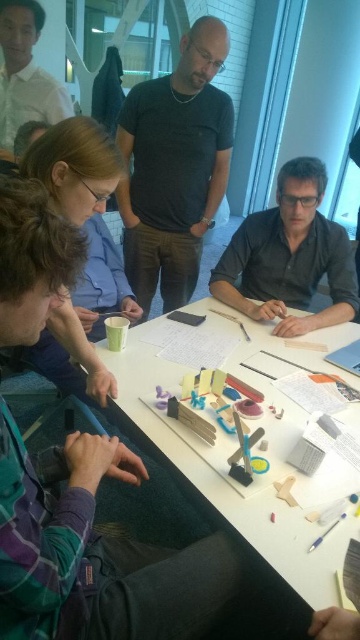
Between black matte shirt at center and matte black shirt at upper center, which one is positioned higher?

Positioned higher is matte black shirt at upper center.

This screenshot has width=360, height=640. What are the coordinates of `black matte shirt at center` in the screenshot? It's located at point(174,168).

Is point (194, 58) farther from camera compared to point (32, 92)?

That is False.

Locate an element on the screen. The image size is (360, 640). black matte shirt at center is located at coordinates (174, 168).

Is point (204, 150) in front of point (339, 228)?

That is False.

Is the position of black matte shirt at center less distant than that of matte black shirt at lower right?

That is False.

At what (x,y) coordinates should I click in order to perform the action: click on black matte shirt at center. Please return your answer as a coordinate pair (x, y). Looking at the image, I should click on (174, 168).

In order to click on black matte shirt at center in this screenshot , I will do `click(174, 168)`.

Is the position of white matte table at center less distant than that of matte black shirt at lower right?

Yes, white matte table at center is closer to the viewer.

Does point (125, 353) come behind point (347, 256)?

That is False.

The width and height of the screenshot is (360, 640). In order to click on white matte table at center in this screenshot , I will do `click(234, 448)`.